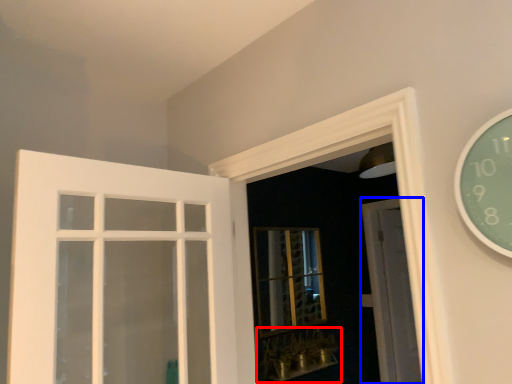
Question: Which point is further to the camera, window sill (highlighted by a red box) or door (highlighted by a blue box)?

Choices:
 (A) window sill
 (B) door

Answer: (B)